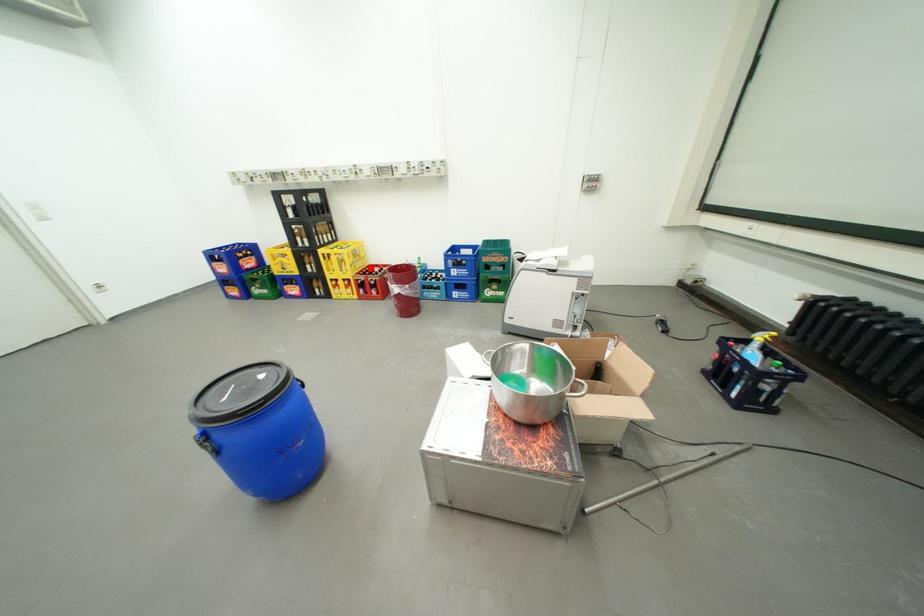
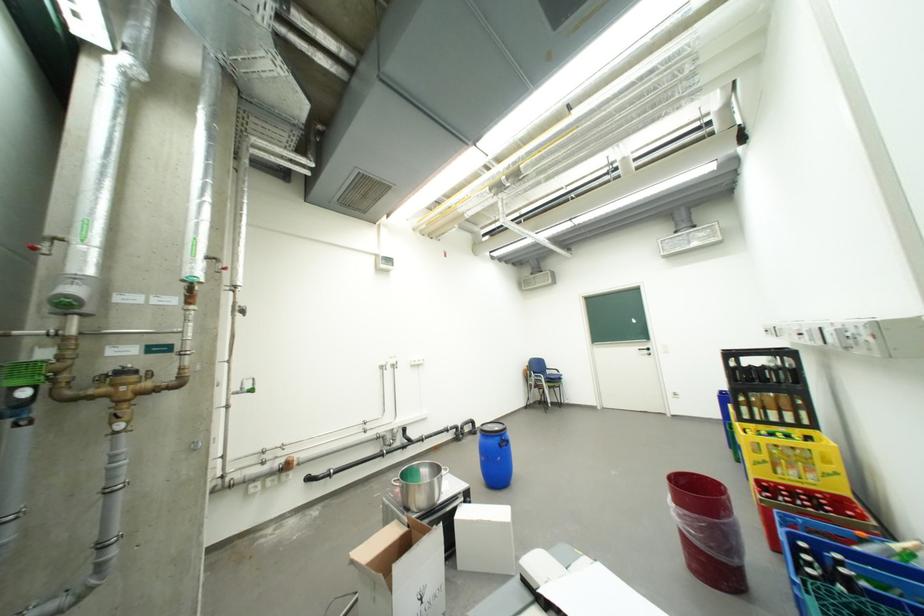
Question: I am providing you with two images of the same scene from different viewpoints. A red point is marked on the first image. Can you still see the location of the red point in image 2?

Choices:
 (A) Yes
 (B) No

Answer: (A)